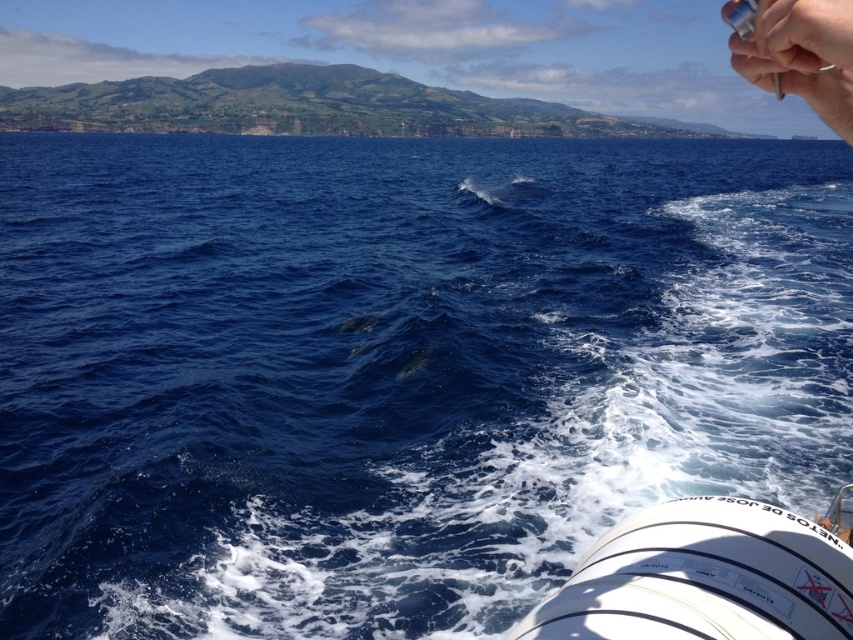
You are holding a metallic pen at upper right and want to point to the white glossy boat at lower right. Is the boat bigger or smaller than the pen?

The white glossy boat at lower right has a smaller size compared to metallic pen at upper right, so the boat is smaller than the pen.

You are holding a metallic pen at upper right and want to point it towards the white glossy boat at lower right. Is the boat within your reach to touch with the pen?

The white glossy boat at lower right is shorter than the metallic pen at upper right. Since the boat is shorter, it is likely farther away than the pen, so you cannot reach it with the pen.